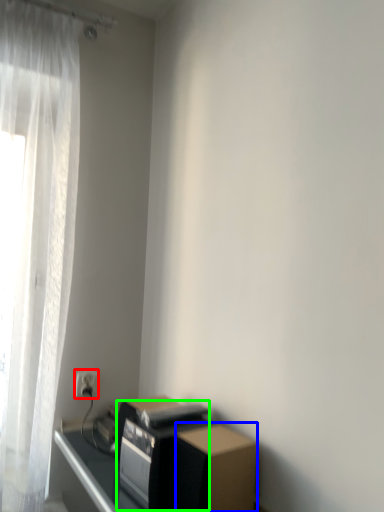
Question: Estimate the real-world distances between objects in this image. Which object is farther from electric outlet (highlighted by a red box), cardboard box (highlighted by a blue box) or appliance (highlighted by a green box)?

Choices:
 (A) cardboard box
 (B) appliance

Answer: (A)